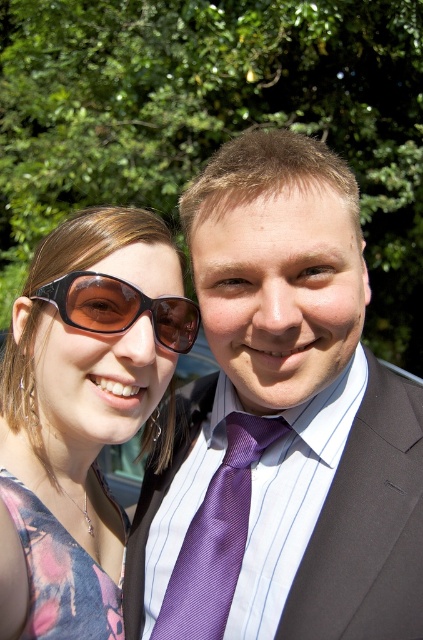
Question: Does purple satin business suit at center have a greater width compared to floral fabric dress at lower left?

Choices:
 (A) yes
 (B) no

Answer: (A)

Question: Which object is positioned closest to the matte black sunglasses at left?

Choices:
 (A) purple silk tie at center
 (B) sunglasses at left
 (C) floral fabric dress at lower left

Answer: (C)

Question: Among these objects, which one is farthest from the camera?

Choices:
 (A) purple silk tie at center
 (B) matte black sunglasses at left

Answer: (A)

Question: Which point is closer to the camera taking this photo?

Choices:
 (A) (249, 506)
 (B) (115, 330)
 (C) (63, 625)

Answer: (C)

Question: Does purple silk tie at center come behind floral fabric dress at lower left?

Choices:
 (A) yes
 (B) no

Answer: (B)

Question: Does purple satin business suit at center have a lesser width compared to sunglasses at left?

Choices:
 (A) no
 (B) yes

Answer: (B)